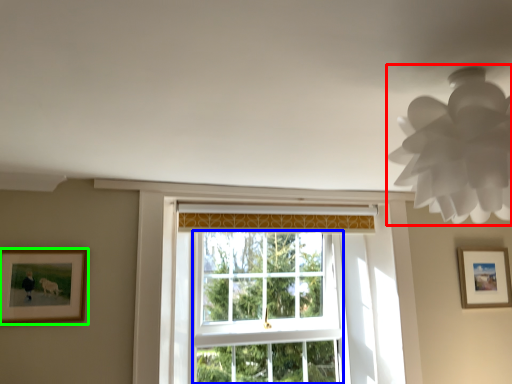
Question: Estimate the real-world distances between objects in this image. Which object is closer to lamp (highlighted by a red box), bay window (highlighted by a blue box) or picture frame (highlighted by a green box)?

Choices:
 (A) bay window
 (B) picture frame

Answer: (B)